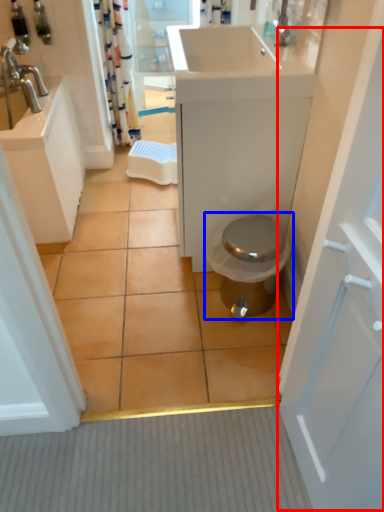
Question: Which object is further to the camera taking this photo, screen door (highlighted by a red box) or toilet (highlighted by a blue box)?

Choices:
 (A) screen door
 (B) toilet

Answer: (B)